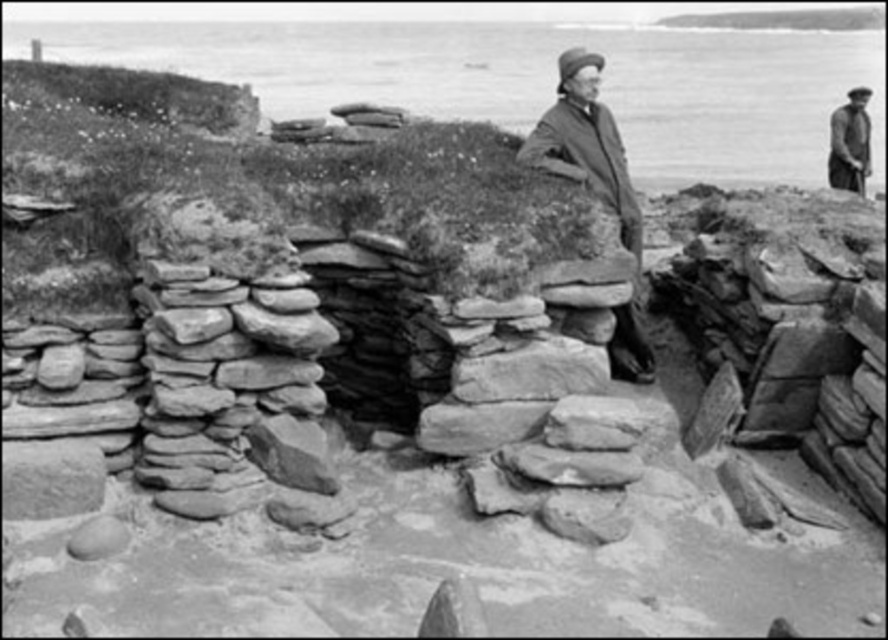
You are an archaeologist examining the site and need to retrieve an item from the ground. You see the smooth woolen coat at center and the smooth dark fabric coat at upper right. Which coat is closer to the ground?

The smooth woolen coat at center is closer to the ground because it is positioned under the smooth dark fabric coat at upper right.

You are an archaeologist examining the site and need to place both the smooth woolen coat at center and the smooth gray rock at center into a storage box. The box can only hold one of them. Which item should you choose to fit in the box based on their sizes?

The smooth gray rock at center is smaller than the smooth woolen coat at center, so you should choose the smooth gray rock at center to fit in the box.